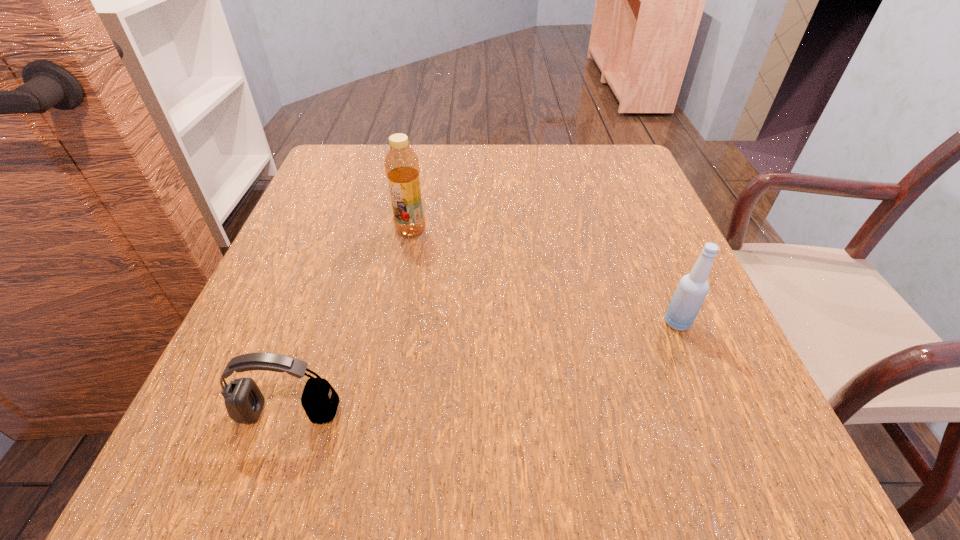
This screenshot has width=960, height=540. I want to click on unoccupied position between the farther bottle and the nearer bottle, so click(x=544, y=276).

The image size is (960, 540). I want to click on vacant area that lies between the leftmost object and the nearer bottle, so click(x=483, y=368).

At what (x,y) coordinates should I click in order to perform the action: click on free area in between the second tallest object and the second object from left to right. Please return your answer as a coordinate pair (x, y). This screenshot has width=960, height=540. Looking at the image, I should click on (544, 276).

The image size is (960, 540). I want to click on empty location between the nearer bottle and the headset, so click(483, 368).

This screenshot has width=960, height=540. I want to click on vacant area between the second shortest object and the shortest object, so click(x=483, y=368).

The width and height of the screenshot is (960, 540). In order to click on free area in between the second farthest object and the taller bottle in this screenshot , I will do `click(544, 276)`.

The width and height of the screenshot is (960, 540). What are the coordinates of `vacant region between the farther bottle and the second nearest object` in the screenshot? It's located at (544, 276).

Where is `vacant space that is in between the tallest object and the shorter bottle`? vacant space that is in between the tallest object and the shorter bottle is located at coordinates [544, 276].

Locate which object is the closest to the second tallest object. Please provide its 2D coordinates. Your answer should be formatted as a tuple, i.e. [(x, y)], where the tuple contains the x and y coordinates of a point satisfying the conditions above.

[(401, 163)]

Locate which object ranks second in proximity to the farthest object. Please provide its 2D coordinates. Your answer should be formatted as a tuple, i.e. [(x, y)], where the tuple contains the x and y coordinates of a point satisfying the conditions above.

[(692, 289)]